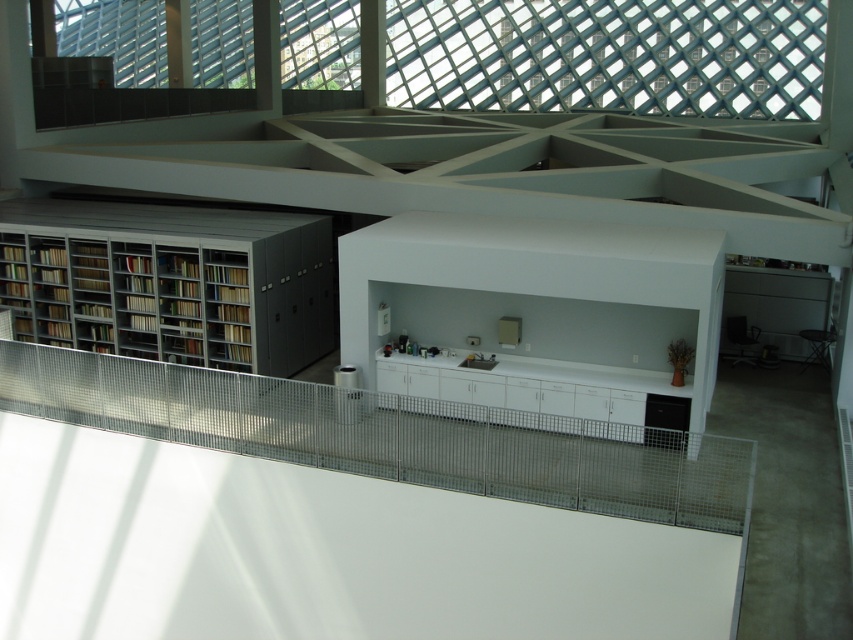
Which is in front, point (527, 93) or point (28, 316)?

Point (28, 316)

Between transparent glass window at upper center and matte gray bookcase at left, which one has more height?

With more height is transparent glass window at upper center.

You are a GUI agent. You are given a task and a screenshot of the screen. Output one action in this format:
    pyautogui.click(x=<x>, y=<y>)
    Task: Click on the transparent glass window at upper center
    
    Given the screenshot: What is the action you would take?
    pyautogui.click(x=608, y=54)